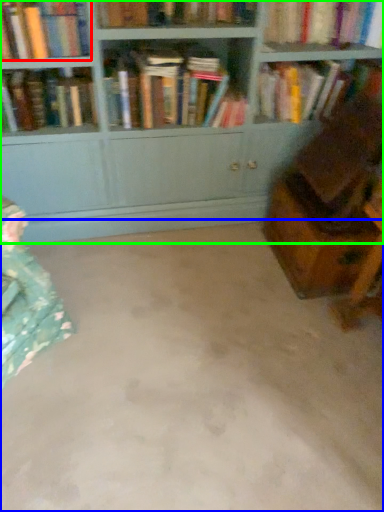
Question: Which object is the closest to the book (highlighted by a red box)? Choose among these: concrete (highlighted by a blue box) or bookcase (highlighted by a green box).

Choices:
 (A) concrete
 (B) bookcase

Answer: (B)